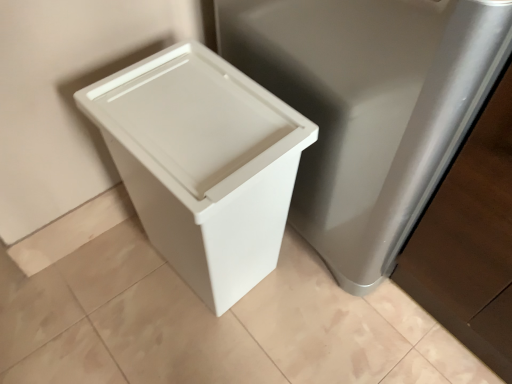
Question: Can you confirm if white plastic waste container at left is shorter than beige wood baseboard at lower left?

Choices:
 (A) yes
 (B) no

Answer: (B)

Question: Is beige wood baseboard at lower left located within white plastic waste container at left?

Choices:
 (A) no
 (B) yes

Answer: (A)

Question: From the image's perspective, would you say white plastic waste container at left is shown under beige wood baseboard at lower left?

Choices:
 (A) yes
 (B) no

Answer: (B)

Question: Considering the relative positions of white plastic waste container at left and beige wood baseboard at lower left in the image provided, is white plastic waste container at left to the right of beige wood baseboard at lower left from the viewer's perspective?

Choices:
 (A) yes
 (B) no

Answer: (A)

Question: Considering the relative sizes of white plastic waste container at left and beige wood baseboard at lower left in the image provided, is white plastic waste container at left wider than beige wood baseboard at lower left?

Choices:
 (A) yes
 (B) no

Answer: (A)

Question: Is white plastic waste container at left closer to camera compared to beige wood baseboard at lower left?

Choices:
 (A) yes
 (B) no

Answer: (A)

Question: Considering the relative sizes of satin silver cabinet at right and white plastic waste container at left in the image provided, is satin silver cabinet at right bigger than white plastic waste container at left?

Choices:
 (A) yes
 (B) no

Answer: (A)

Question: Is satin silver cabinet at right wider than white plastic waste container at left?

Choices:
 (A) no
 (B) yes

Answer: (B)

Question: Does satin silver cabinet at right have a greater height compared to white plastic waste container at left?

Choices:
 (A) yes
 (B) no

Answer: (A)

Question: Is satin silver cabinet at right far away from white plastic waste container at left?

Choices:
 (A) no
 (B) yes

Answer: (A)

Question: Is satin silver cabinet at right placed right next to white plastic waste container at left?

Choices:
 (A) yes
 (B) no

Answer: (B)

Question: Does satin silver cabinet at right have a lesser width compared to white plastic waste container at left?

Choices:
 (A) yes
 (B) no

Answer: (B)

Question: Considering the relative positions of beige wood baseboard at lower left and satin silver cabinet at right in the image provided, is beige wood baseboard at lower left to the right of satin silver cabinet at right from the viewer's perspective?

Choices:
 (A) yes
 (B) no

Answer: (B)